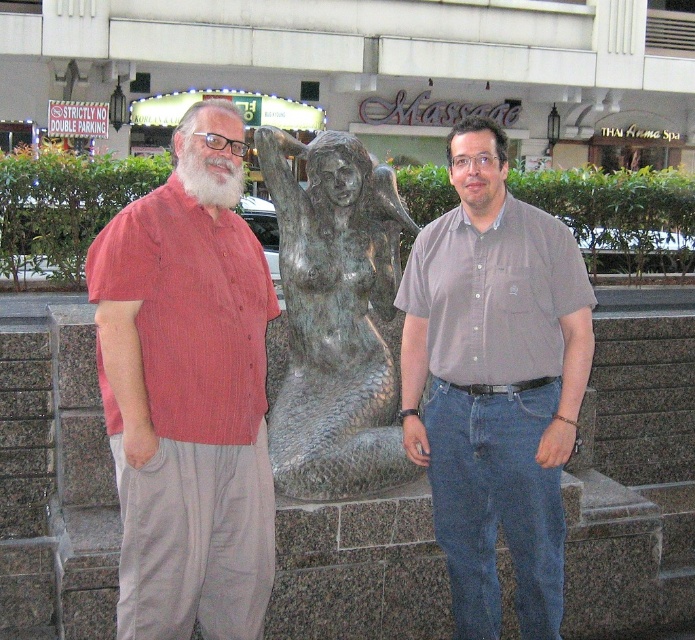
Question: In this image, where is red striped shirt at left located relative to white matte beard at left?

Choices:
 (A) above
 (B) below

Answer: (B)

Question: Observing the image, what is the correct spatial positioning of bronze statue at center in reference to white matte beard at center?

Choices:
 (A) below
 (B) above

Answer: (A)

Question: Among these objects, which one is farthest from the camera?

Choices:
 (A) matte gray shirt at center
 (B) bronze statue at center
 (C) red striped shirt at left
 (D) white matte beard at center

Answer: (B)

Question: Can you confirm if white matte beard at left is positioned above white matte beard at center?

Choices:
 (A) yes
 (B) no

Answer: (A)

Question: Which object is closer to the camera taking this photo?

Choices:
 (A) red striped shirt at left
 (B) bronze statue at center

Answer: (A)

Question: Estimate the real-world distances between objects in this image. Which object is farther from the red striped shirt at left?

Choices:
 (A) bronze statue at center
 (B) matte gray shirt at center
 (C) white matte beard at center
 (D) white matte beard at left

Answer: (C)